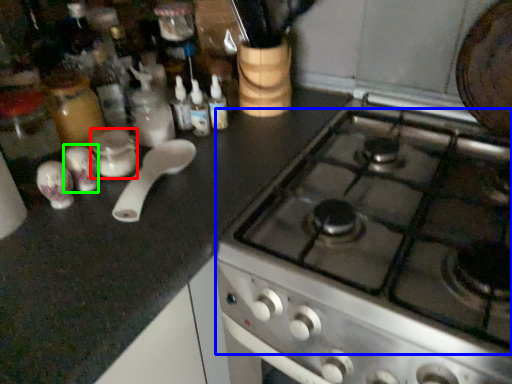
Question: Based on their relative distances, which object is farther from appliance (highlighted by a red box)? Choose from gas stove (highlighted by a blue box) and tableware (highlighted by a green box).

Choices:
 (A) gas stove
 (B) tableware

Answer: (A)